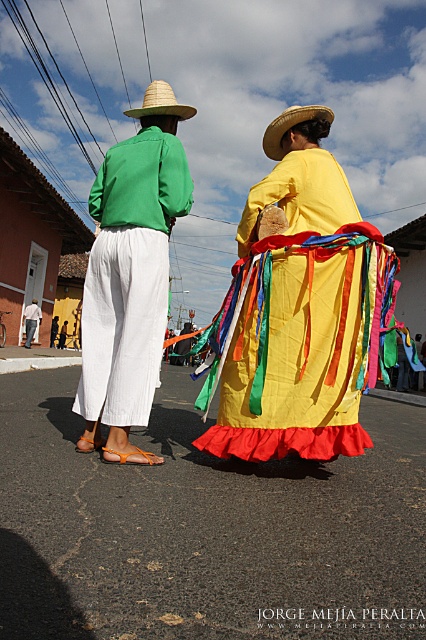
Describe the element at coordinates (301, 308) in the screenshot. I see `yellow satin dress at center` at that location.

Which is more to the right, yellow satin dress at center or green cotton shirt at left?

Positioned to the right is yellow satin dress at center.

Locate an element on the screen. yellow satin dress at center is located at coordinates (301, 308).

Is yellow satin dress at center wider than straw woven cowboy hat at back?

Incorrect, yellow satin dress at center's width does not surpass straw woven cowboy hat at back's.

In the scene shown: Is yellow satin dress at center to the right of straw woven cowboy hat at back from the viewer's perspective?

No, yellow satin dress at center is not to the right of straw woven cowboy hat at back.

Where is `yellow satin dress at center`? This screenshot has height=640, width=426. yellow satin dress at center is located at coordinates (301, 308).

Who is lower down, yellow satin dress at center or matte green shirt at center?

matte green shirt at center

Who is higher up, yellow satin dress at center or matte green shirt at center?

yellow satin dress at center is above.

Who is more forward, (250, 211) or (23, 317)?

Point (250, 211) is more forward.

Where is `yellow satin dress at center`? This screenshot has height=640, width=426. yellow satin dress at center is located at coordinates coord(301,308).